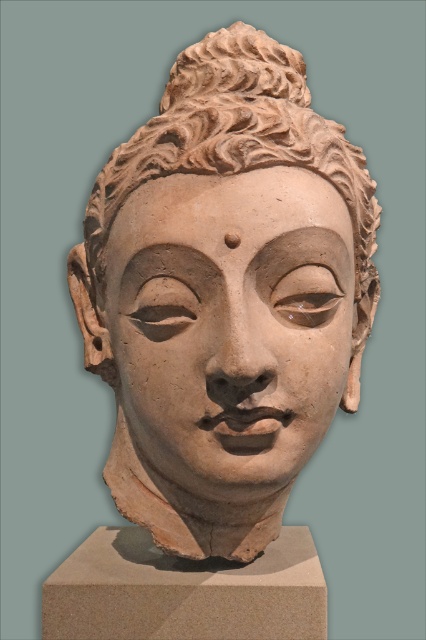
Is matte clay head at center positioned before matte clay face at center?

That is False.

Between matte clay head at center and matte clay face at center, which one is positioned higher?

matte clay head at center is above.

Measure the distance between point (109, 321) and camera.

Point (109, 321) is 1.11 meters away from camera.

What are the coordinates of `matte clay head at center` in the screenshot? It's located at (226, 294).